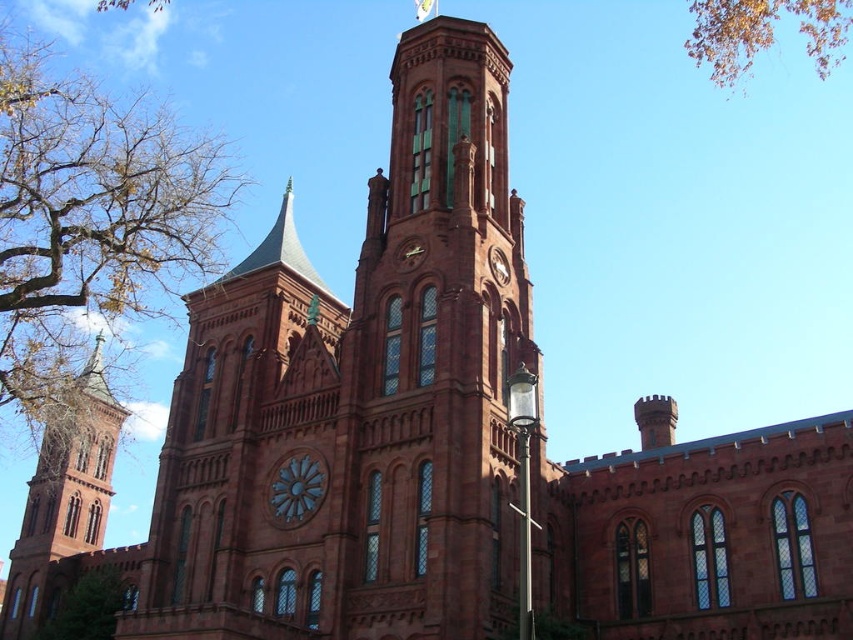
You are standing in front of the historic building and notice the matte brick tower at center and the yellow leafy branches at upper right. Which object is positioned higher in the image?

The yellow leafy branches at upper right are positioned higher than the matte brick tower at center because the matte brick tower at center is located below them.

You are standing in front of the historic building and notice two points marked on the image. The first point is at coordinates point [383,435] and the second is at point [814,40]. Which point is closer to your current position?

Point [383,435] is closer to the camera than point [814,40], so the first point is closer to your current position.

You are standing in front of the historic building and want to take a photo that includes both the brown leafy tree at left and the green leafy tree at lower left. Which tree should you position closer to the building to ensure both are in the frame?

You should position the brown leafy tree at left closer to the building because it is already closer to the viewer than the green leafy tree at lower left, so adjusting its position can help frame both effectively.